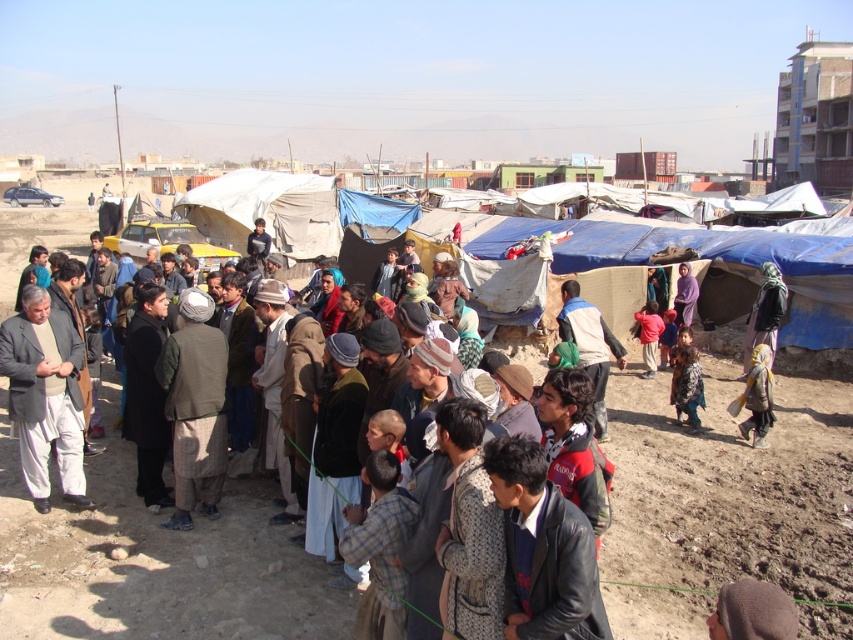
Question: Which object is positioned farthest from the brown fabric at lower right?

Choices:
 (A) dark blue jacket at center
 (B) purple fabric at center

Answer: (B)

Question: Does yellow fabric headscarf at lower right appear on the left side of purple fabric at center?

Choices:
 (A) no
 (B) yes

Answer: (B)

Question: Is leather jacket at center above yellow fabric headscarf at lower right?

Choices:
 (A) yes
 (B) no

Answer: (B)

Question: Which is nearer to the pink fabric at center?

Choices:
 (A) brown fabric at lower right
 (B) purple fabric at center

Answer: (B)

Question: Which object is closer to the camera taking this photo?

Choices:
 (A) dark blue jacket at center
 (B) light brown fabric jacket at left
 (C) brown fabric at lower right

Answer: (C)

Question: Is brown fabric at lower right wider than dark blue jacket at center?

Choices:
 (A) yes
 (B) no

Answer: (B)